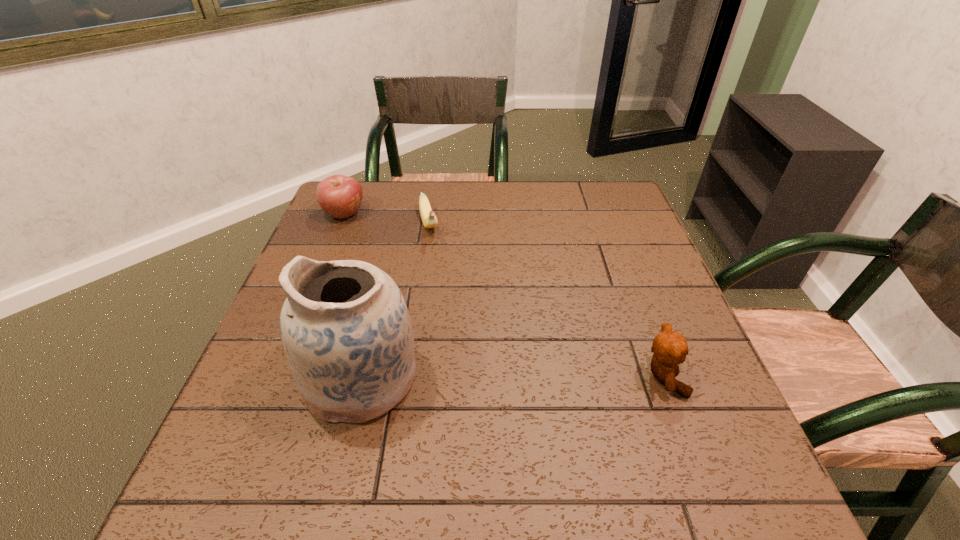
The width and height of the screenshot is (960, 540). In the image, there is a desktop. What are the coordinates of `vacant area at the far edge` in the screenshot? It's located at (547, 185).

Where is `vacant space at the near edge of the desktop`? vacant space at the near edge of the desktop is located at coordinates (347, 441).

In the image, there is a desktop. Where is `vacant space at the left edge`? vacant space at the left edge is located at coordinates (321, 244).

This screenshot has width=960, height=540. I want to click on vacant area at the right edge of the desktop, so click(x=658, y=287).

Find the location of a particular element. The height and width of the screenshot is (540, 960). free location at the far left corner is located at coordinates (377, 182).

You are a GUI agent. You are given a task and a screenshot of the screen. Output one action in this format:
    pyautogui.click(x=<x>, y=<y>)
    Task: Click on the vacant point at the far right corner
    This screenshot has height=540, width=960.
    Given the screenshot: What is the action you would take?
    pyautogui.click(x=616, y=215)

Image resolution: width=960 pixels, height=540 pixels. Identify the location of free spot between the tallest object and the rightmost object. (513, 377).

Where is `vacant point located between the apple and the rightmost object`? This screenshot has height=540, width=960. vacant point located between the apple and the rightmost object is located at coordinates (504, 295).

This screenshot has height=540, width=960. What are the coordinates of `object that is the second nearest to the tallest object` in the screenshot? It's located at (340, 196).

Locate an element on the screen. The image size is (960, 540). object that is the second closest to the apple is located at coordinates (345, 327).